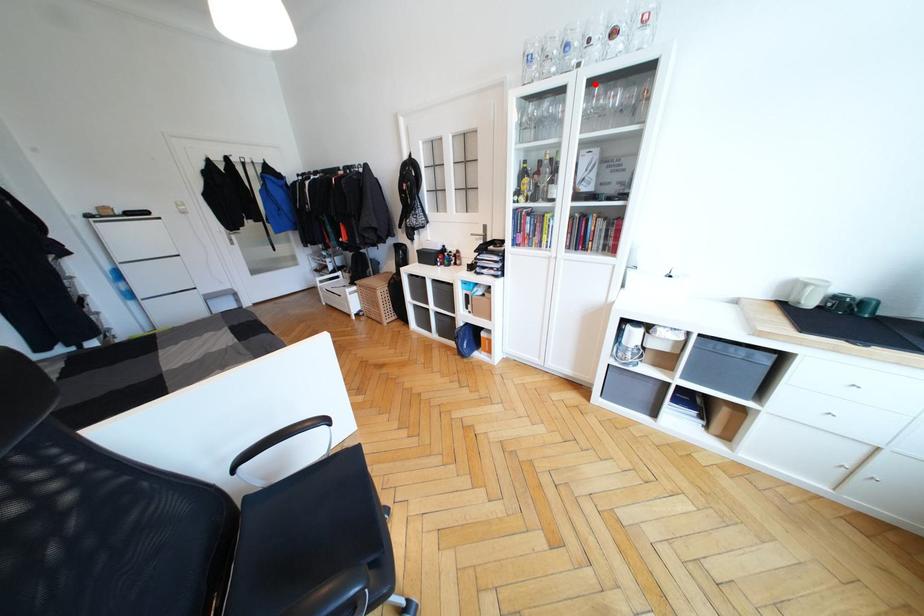
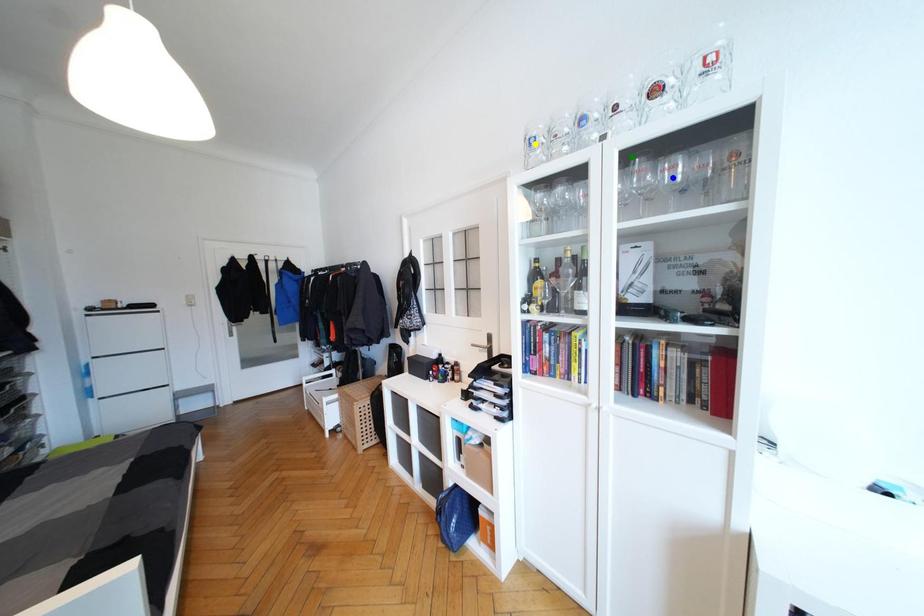
Question: I am providing you with two images of the same scene from different viewpoints. A red point is marked on the first image. You are given multiple points on the second image. In image 2, which mark is for the same physical point as the one in image 1?

Choices:
 (A) green point
 (B) yellow point
 (C) blue point

Answer: (A)